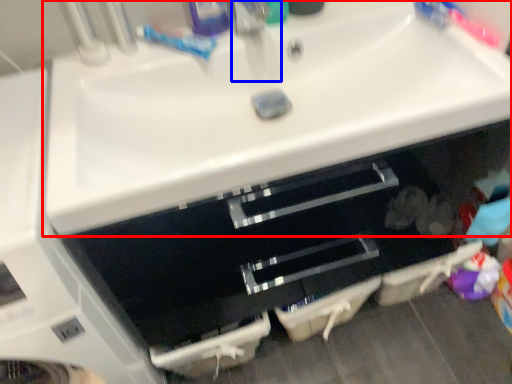
Question: Which of the following is the closest to the observer, sink (highlighted by a red box) or faucet (highlighted by a blue box)?

Choices:
 (A) sink
 (B) faucet

Answer: (A)